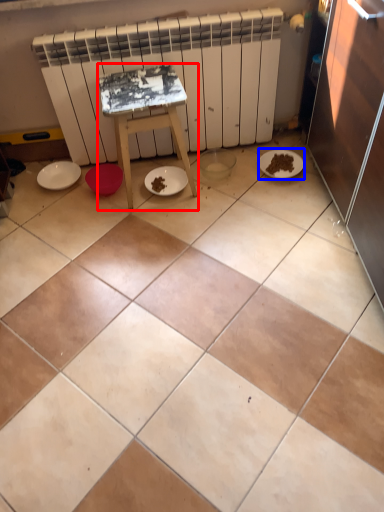
Question: Which point is closer to the camera, furniture (highlighted by a red box) or paper plate (highlighted by a blue box)?

Choices:
 (A) furniture
 (B) paper plate

Answer: (A)